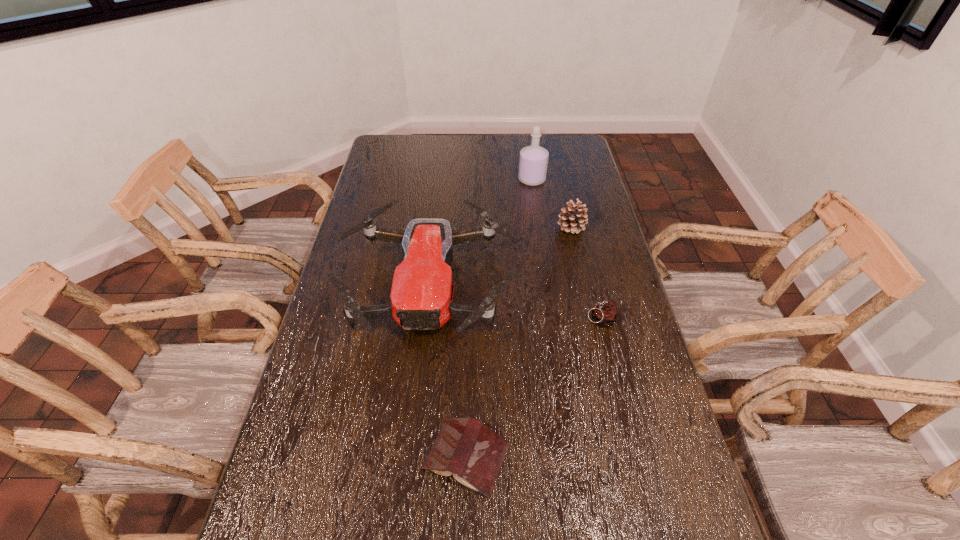
At what (x,y) coordinates should I click in order to perform the action: click on blank space located 0.060m on the front-facing side of the second tallest object. Please return your answer as a coordinate pair (x, y). This screenshot has height=540, width=960. Looking at the image, I should click on (418, 382).

You are a GUI agent. You are given a task and a screenshot of the screen. Output one action in this format:
    pyautogui.click(x=<x>, y=<y>)
    Task: Click on the vacant space positioned 0.210m on the front of the farther pinecone
    The height and width of the screenshot is (540, 960).
    Given the screenshot: What is the action you would take?
    pyautogui.click(x=583, y=279)

The height and width of the screenshot is (540, 960). What are the coordinates of `vacant position located 0.200m with a leaf charm attached to the shorter pinecone` in the screenshot? It's located at (517, 319).

Where is `vacant region located 0.290m with a leaf charm attached to the shorter pinecone`? vacant region located 0.290m with a leaf charm attached to the shorter pinecone is located at coordinates pos(487,319).

The image size is (960, 540). Identify the location of free space located with a leaf charm attached to the shorter pinecone. (540, 319).

You are a GUI agent. You are given a task and a screenshot of the screen. Output one action in this format:
    pyautogui.click(x=<x>, y=<y>)
    Task: Click on the vacant space located 0.050m on the back of the shortest object
    Image resolution: width=960 pixels, height=540 pixels.
    Given the screenshot: What is the action you would take?
    pyautogui.click(x=468, y=401)

This screenshot has width=960, height=540. I want to click on object situated at the left edge, so click(421, 295).

In the image, there is a desktop. Identify the location of free region at the far edge. (476, 145).

The image size is (960, 540). I want to click on vacant position at the left edge of the desktop, so click(313, 373).

In the image, there is a desktop. Find the location of `blank space at the right edge`. blank space at the right edge is located at coordinates (603, 230).